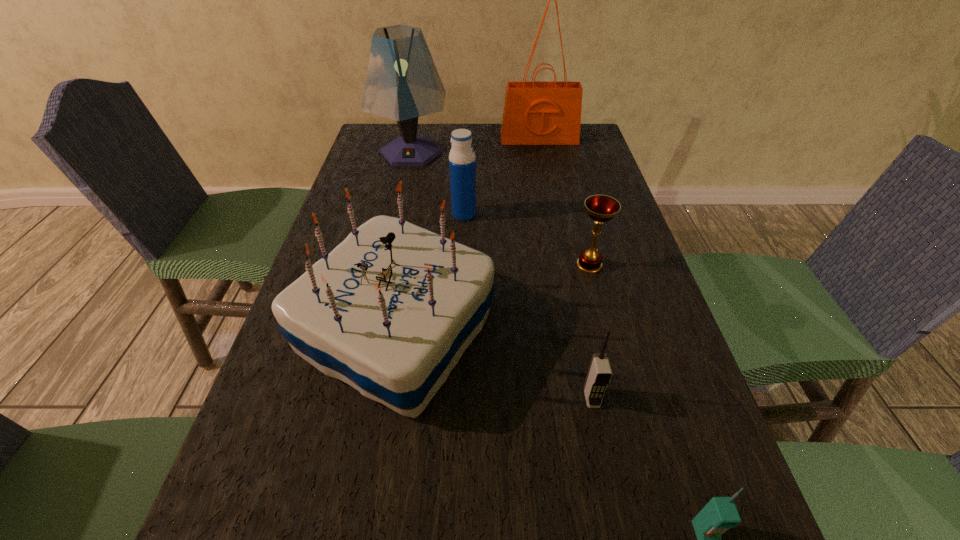
Identify the location of the tallest object. (535, 113).

Image resolution: width=960 pixels, height=540 pixels. In order to click on the sixth shortest object in this screenshot , I will do `click(402, 83)`.

Locate an element on the screen. This screenshot has height=540, width=960. the fifth shortest object is located at coordinates coord(390,311).

Image resolution: width=960 pixels, height=540 pixels. In order to click on the third farthest object in this screenshot , I will do `click(462, 161)`.

At what (x,y) coordinates should I click in order to perform the action: click on water bottle. Please return your answer as a coordinate pair (x, y). The width and height of the screenshot is (960, 540). Looking at the image, I should click on (462, 161).

Identify the location of the left cellular telephone. The height and width of the screenshot is (540, 960). (599, 374).

Image resolution: width=960 pixels, height=540 pixels. Find the location of `the farther cellular telephone`. the farther cellular telephone is located at coordinates (599, 374).

Locate an element on the screen. chalice is located at coordinates (601, 208).

The image size is (960, 540). Identify the location of free space located on the logo side of the tallest object. (550, 192).

Locate an element on the screen. This screenshot has width=960, height=540. free space located on the base of the second tallest object is located at coordinates (387, 260).